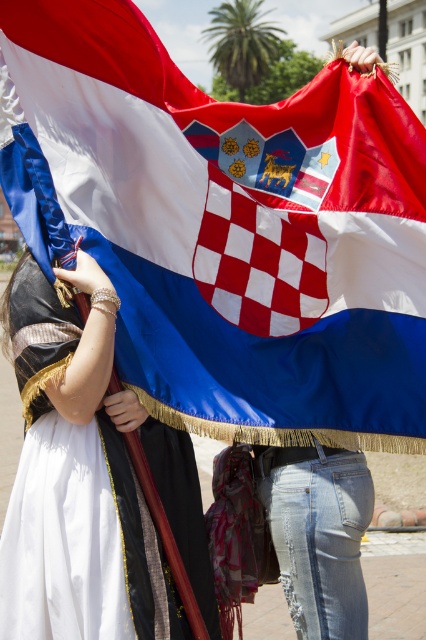
Which is behind, point (222, 406) or point (158, 460)?

The point (158, 460) is more distant.

Can you confirm if silky fabric flag at center is thinner than matte black dress at left?

No.

The width and height of the screenshot is (426, 640). What do you see at coordinates (229, 228) in the screenshot?
I see `silky fabric flag at center` at bounding box center [229, 228].

Locate an element on the screen. silky fabric flag at center is located at coordinates (229, 228).